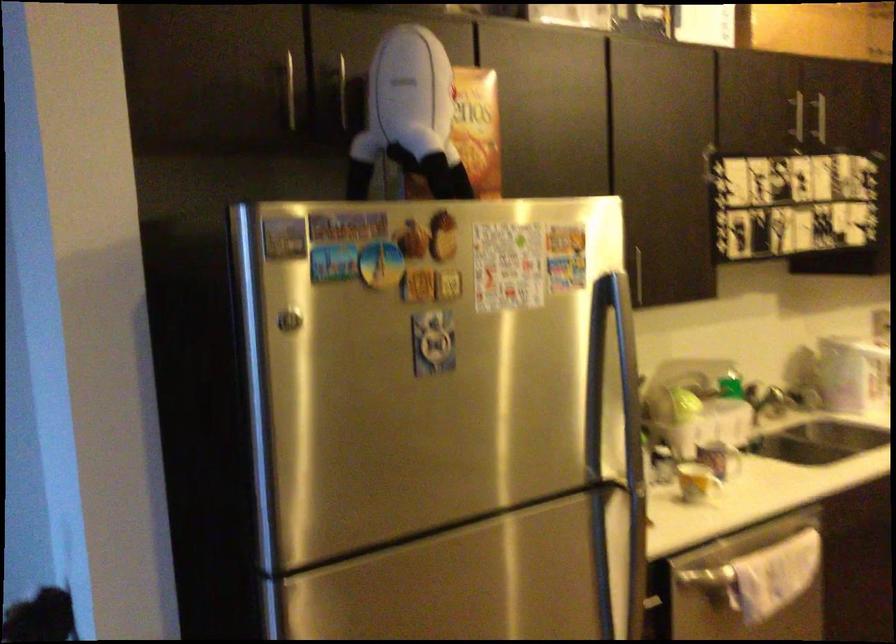
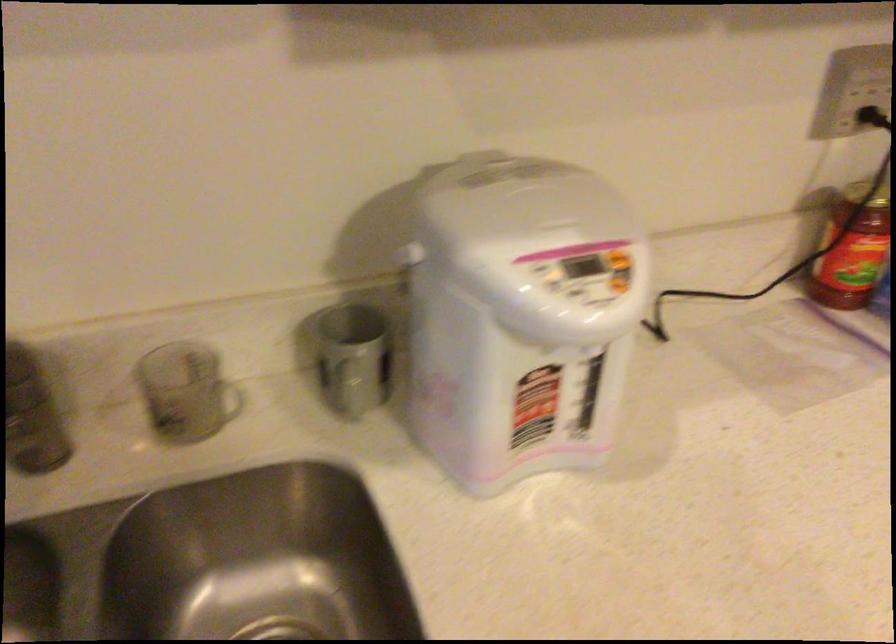
The images are taken continuously from a first-person perspective. In which direction are you moving?

The cameraman moved toward right, forward.